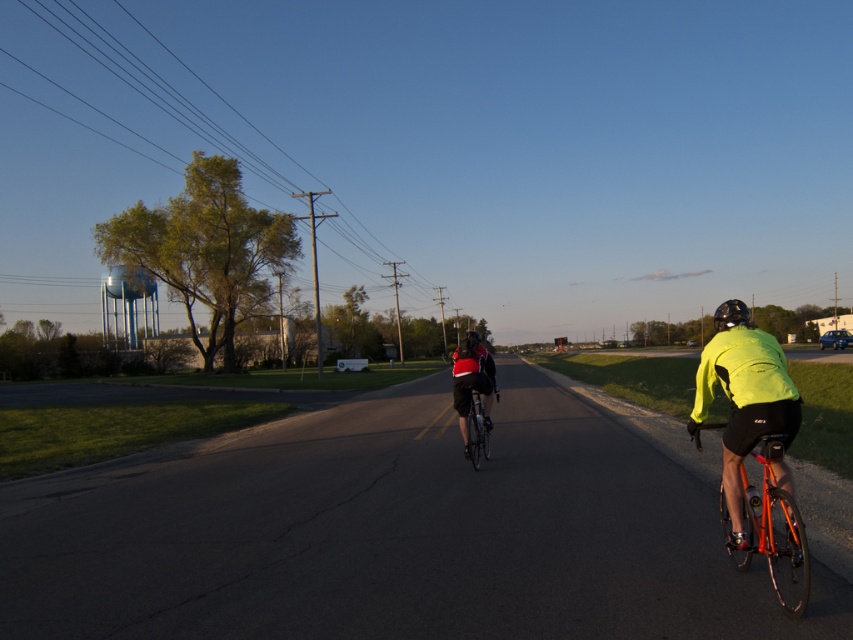
Who is positioned more to the right, orange metallic bicycle at right or shiny metallic bicycle at center?

Positioned to the right is orange metallic bicycle at right.

Who is more distant from viewer, (785, 552) or (467, 419)?

Positioned behind is point (467, 419).

At what (x,y) coordinates should I click in order to perform the action: click on orange metallic bicycle at right. Please return your answer as a coordinate pair (x, y). The image size is (853, 640). Looking at the image, I should click on [x=775, y=531].

Which is more to the right, orange metallic bicycle at right or matte black jacket at center?

Positioned to the right is orange metallic bicycle at right.

Is orange metallic bicycle at right wider than matte black jacket at center?

In fact, orange metallic bicycle at right might be narrower than matte black jacket at center.

This screenshot has height=640, width=853. In order to click on orange metallic bicycle at right in this screenshot , I will do `click(775, 531)`.

Find the location of a particular element. The image size is (853, 640). orange metallic bicycle at right is located at coordinates coord(775,531).

Is matte black jacket at center shorter than shiny black helmet at right?

Incorrect, matte black jacket at center's height does not fall short of shiny black helmet at right's.

Between matte black jacket at center and shiny black helmet at right, which one has more height?

Standing taller between the two is matte black jacket at center.

Where is `matte black jacket at center`? The height and width of the screenshot is (640, 853). matte black jacket at center is located at coordinates (471, 381).

This screenshot has width=853, height=640. In order to click on matte black jacket at center in this screenshot , I will do `click(471, 381)`.